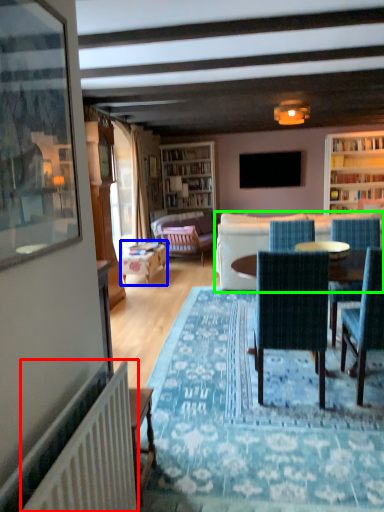
Question: Based on their relative distances, which object is nearer to radiator (highlighted by a red box)? Choose from table (highlighted by a blue box) and studio couch (highlighted by a green box).

Choices:
 (A) table
 (B) studio couch

Answer: (B)